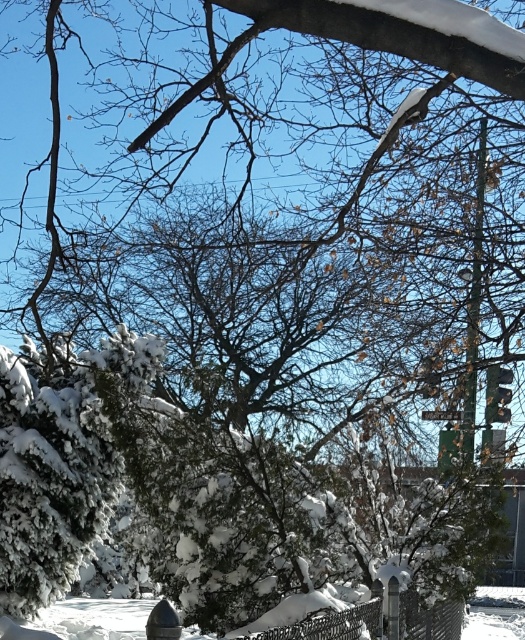
Which is more to the left, metallic wire fence at lower center or green metallic pole at upper right?

From the viewer's perspective, metallic wire fence at lower center appears more on the left side.

Who is higher up, metallic wire fence at lower center or green metallic pole at upper right?

green metallic pole at upper right is above.

Describe the element at coordinates (376, 618) in the screenshot. I see `metallic wire fence at lower center` at that location.

At what (x,y) coordinates should I click in order to perform the action: click on metallic wire fence at lower center. Please return your answer as a coordinate pair (x, y). Looking at the image, I should click on (376, 618).

Between green metallic pole at upper right and shiny metallic hydrant at lower center, which one appears on the right side from the viewer's perspective?

From the viewer's perspective, green metallic pole at upper right appears more on the right side.

Consider the image. Is green metallic pole at upper right positioned at the back of shiny metallic hydrant at lower center?

Yes.

Is point (472, 440) farther from camera compared to point (155, 628)?

Yes, it is behind point (155, 628).

This screenshot has height=640, width=525. What are the coordinates of `green metallic pole at upper right` in the screenshot? It's located at (474, 305).

Who is lower down, metallic wire fence at lower center or shiny metallic hydrant at lower center?

Positioned lower is metallic wire fence at lower center.

Between metallic wire fence at lower center and shiny metallic hydrant at lower center, which one is positioned higher?

shiny metallic hydrant at lower center is higher up.

I want to click on metallic wire fence at lower center, so click(x=376, y=618).

Where is `metallic wire fence at lower center`? The height and width of the screenshot is (640, 525). metallic wire fence at lower center is located at coordinates (376, 618).